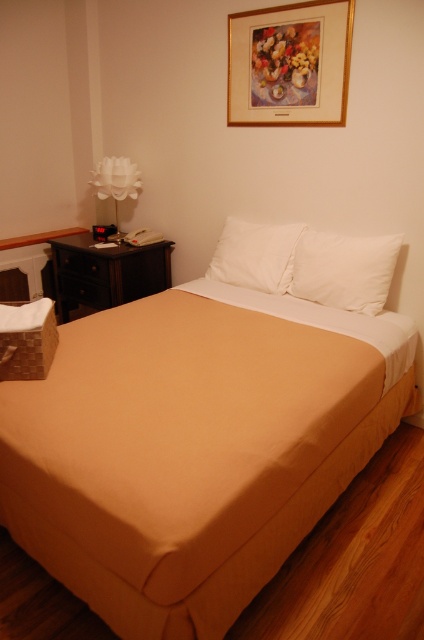
Question: Does beige fabric bed at center appear on the left side of white smooth pillow at upper right?

Choices:
 (A) yes
 (B) no

Answer: (A)

Question: Which is nearer to the white soft pillow at center?

Choices:
 (A) white fabric lamp at left
 (B) white smooth pillow at upper right

Answer: (B)

Question: Which is nearer to the white soft pillow at center?

Choices:
 (A) beige fabric bed at center
 (B) white smooth pillow at upper right
 (C) gold-framed artwork at upper center

Answer: (B)

Question: Where is beige fabric bed at center located in relation to white soft pillow at center in the image?

Choices:
 (A) below
 (B) above

Answer: (A)

Question: Which is farther from the white smooth pillow at upper right?

Choices:
 (A) white soft pillow at center
 (B) gold-framed artwork at upper center

Answer: (B)

Question: Can you confirm if gold-framed artwork at upper center is wider than white fabric lamp at left?

Choices:
 (A) yes
 (B) no

Answer: (A)